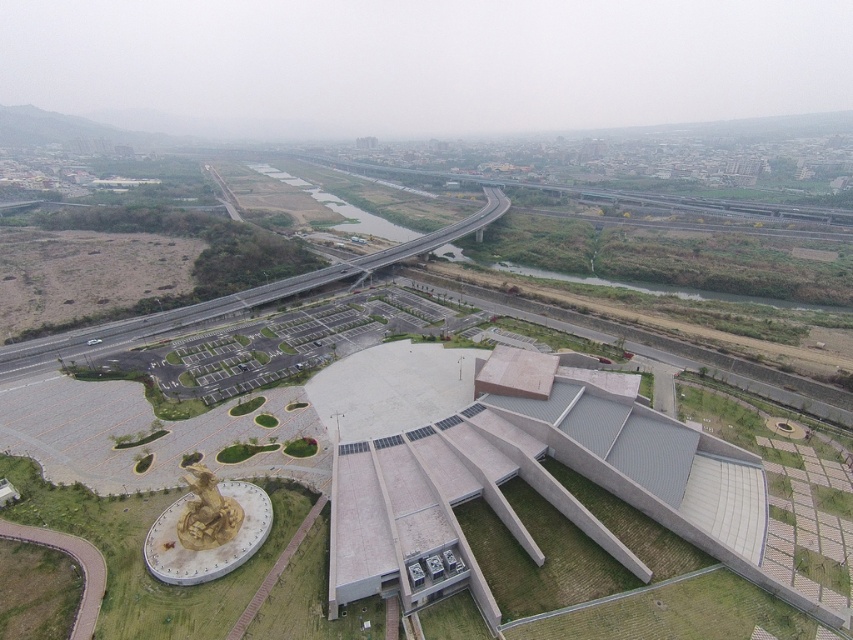
You are a drone operator planning to fly a drone from the gray concrete building at center to the gold metallic statue at lower left. The drone has a maximum flight range of 100 feet. Based on the scene, will the drone be able to reach the statue without needing to recharge?

The gray concrete building at center and gold metallic statue at lower left are 106.48 feet apart. Since the drone can only fly 100 feet before needing to recharge, it will not be able to reach the statue without recharging.

In the scene shown: You are a drone operator trying to capture a photo of the gold metallic statue at lower left and the gray concrete building at center from above. Based on their positions, which object should you position the drone closer to in order to frame both in the same shot?

The gray concrete building at center is to the right of the gold metallic statue at lower left, so positioning the drone closer to the gold metallic statue at lower left would allow both objects to be framed in the same shot since they are aligned horizontally.

You are an architect reviewing this design. The city council is concerned about the structural integrity of the building. Based on the image, does the gray concrete building at center appear to be supported above the gold metallic statue at lower left?

Yes, the gray concrete building at center is positioned over the gold metallic statue at lower left, which suggests it is supported above it.